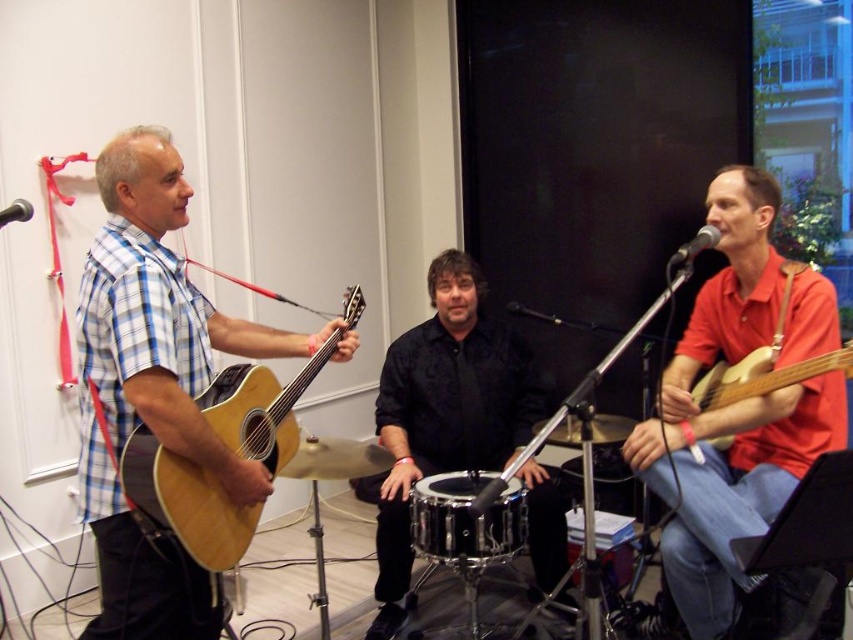
You are setting up a stage for a small indoor performance. You need to place a stand for the black metallic microphone at upper right so it doesn not hit the taller black metallic drum at center. Where should you position the microphone stand?

The black metallic drum at center is taller than the black metallic microphone at upper right. To prevent the microphone stand from hitting the drum, position the microphone stand to the side of the drum, ensuring there is enough space between them.

You are a sound technician setting up for the performance. You need to place a new microphone stand that requires more space due to its base size. Which microphone, the black metallic microphone at upper left or the black metallic microphone at center, should you replace to accommodate the larger stand?

The black metallic microphone at center has a greater width than the black metallic microphone at upper left, so replacing the black metallic microphone at center would be necessary to accommodate the larger stand since it occupies more space.